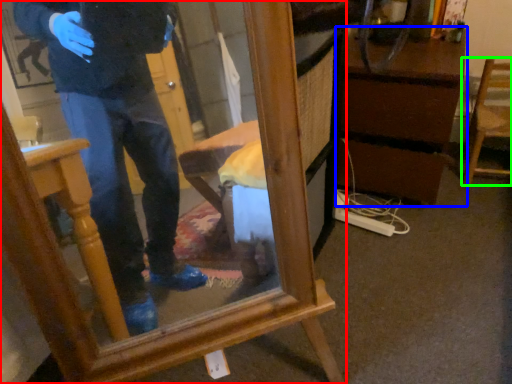
Question: Estimate the real-world distances between objects in this image. Which object is farther from furniture (highlighted by a red box), vanity (highlighted by a blue box) or chair (highlighted by a green box)?

Choices:
 (A) vanity
 (B) chair

Answer: (B)